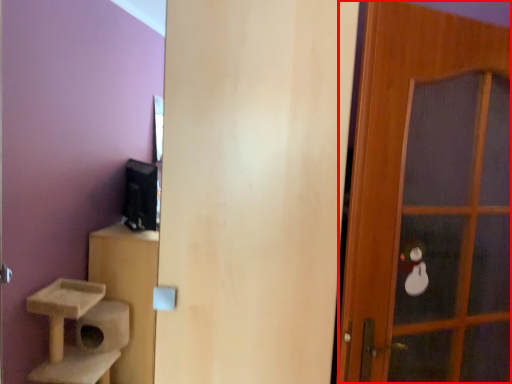
Question: From the image's perspective, where is door (annotated by the red box) located in relation to door in the image?

Choices:
 (A) above
 (B) below

Answer: (A)